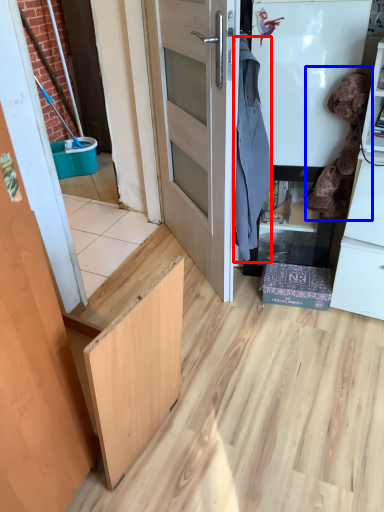
Question: Which of the following is the farthest to the observer, laundry (highlighted by a red box) or laundry (highlighted by a blue box)?

Choices:
 (A) laundry
 (B) laundry

Answer: (B)